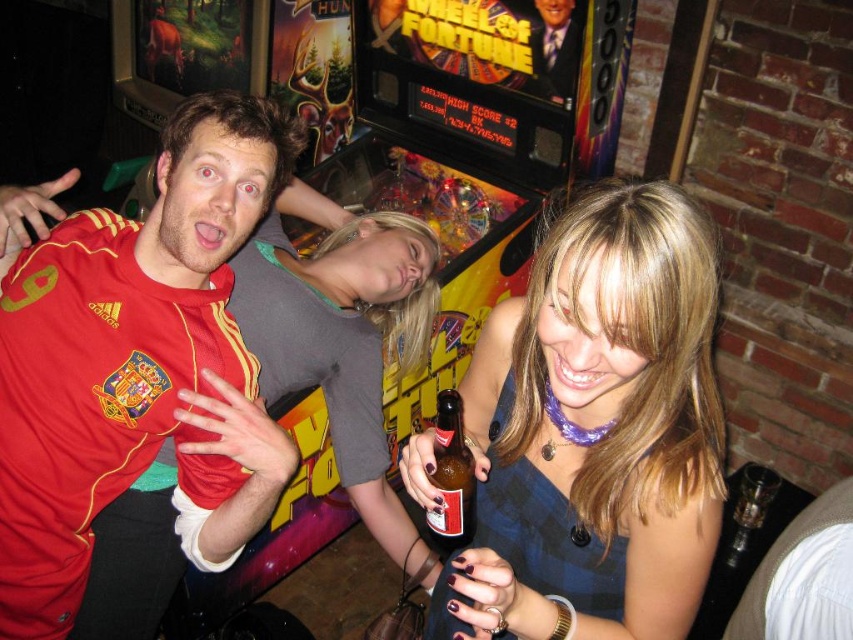
Question: Does matte blue dress at center have a larger size compared to matte jersey at left?

Choices:
 (A) yes
 (B) no

Answer: (A)

Question: Which point is farther to the camera?

Choices:
 (A) (448, 461)
 (B) (123, 280)
 (C) (643, 250)

Answer: (B)

Question: Is matte blue dress at center to the right of brown glass bottle at center from the viewer's perspective?

Choices:
 (A) no
 (B) yes

Answer: (B)

Question: Which of the following is the farthest from the observer?

Choices:
 (A) (20, 339)
 (B) (462, 408)

Answer: (B)

Question: Which point appears closest to the camera in this image?

Choices:
 (A) (426, 516)
 (B) (132, 237)

Answer: (A)

Question: Observing the image, what is the correct spatial positioning of matte jersey at left in reference to brown glass bottle at center?

Choices:
 (A) right
 (B) left

Answer: (B)